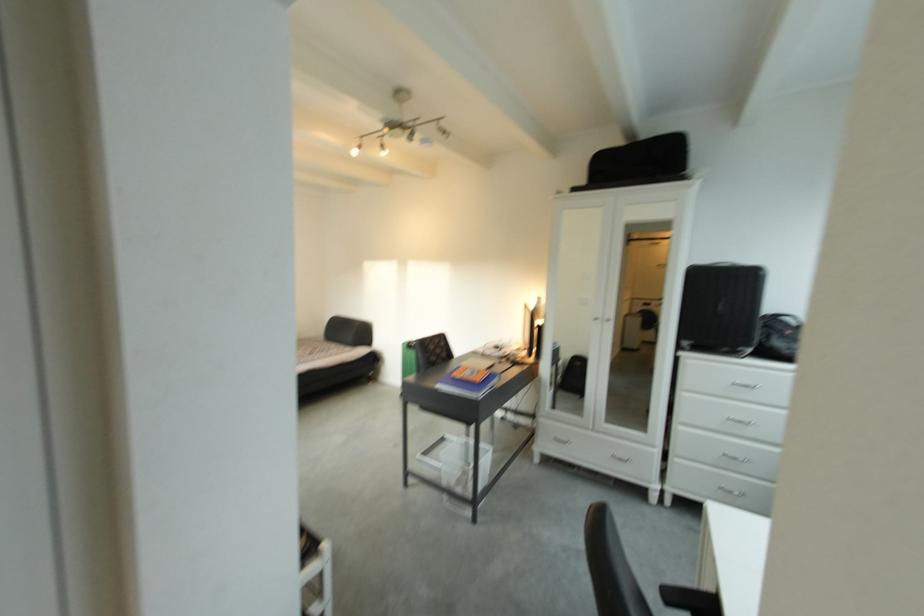
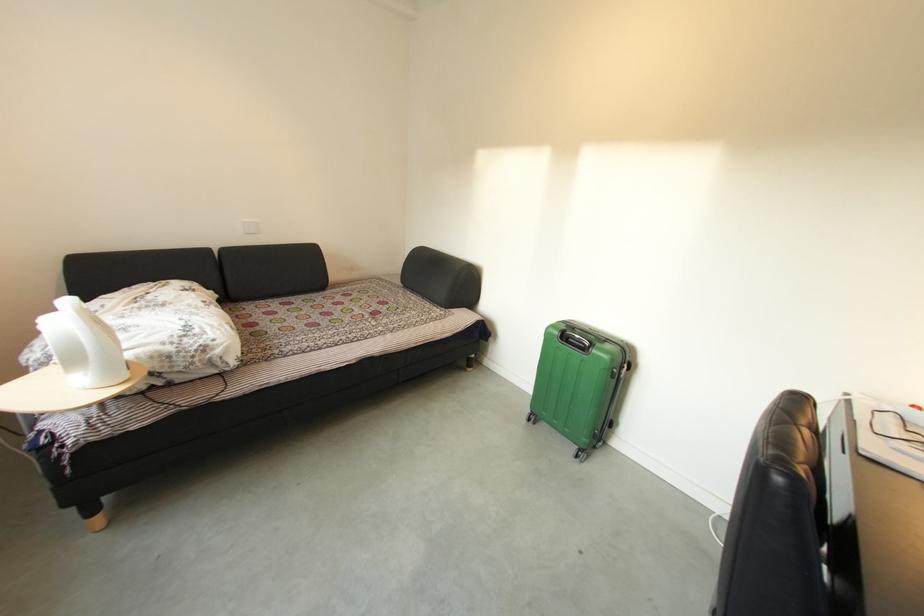
Where in the second image is the point corresponding to pixel 417 349 from the first image?

(568, 336)